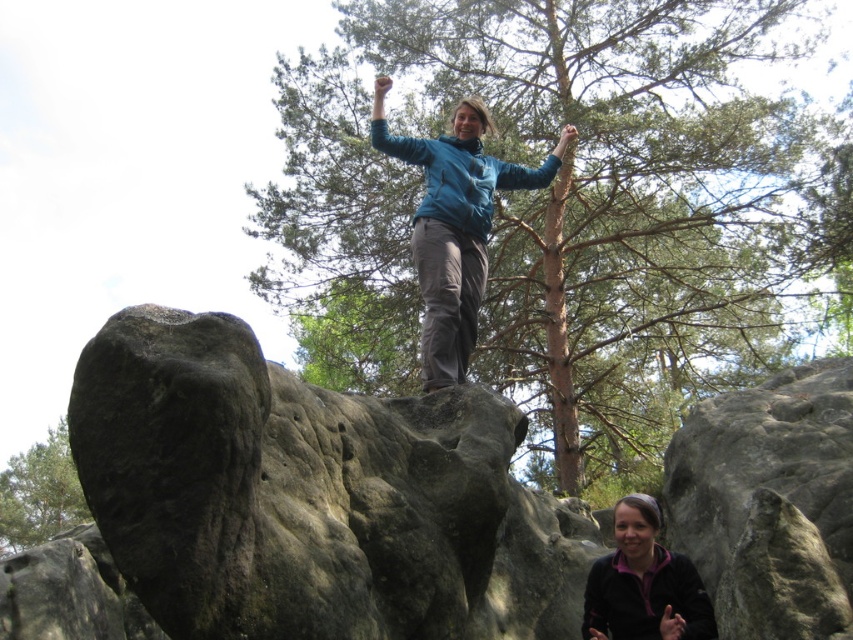
You are planning to take a photo of the two trees in the scene. The photographer wants to ensure that the brown textured tree at upper center and the green leafy tree at upper left are both visible in the frame. Considering their sizes, which tree should be placed closer to the edges of the frame to avoid overcrowding the composition?

The brown textured tree at upper center is wider than the green leafy tree at upper left, so placing the wider brown textured tree at upper center closer to the edges of the frame would help prevent overcrowding the composition.

You are a hiker who wants to place a 3 feet long hiking pole between the dark gray rough rock at center and the matte black jacket at lower center. Can you fit the pole between them without bending it?

The distance between the dark gray rough rock at center and the matte black jacket at lower center is 9.17 feet. Since the pole is 3 feet long, it can easily fit between them without bending.

You are a photographer trying to capture a clear photo of the teal fabric jacket at center and the brown textured tree at upper center. However, the tree is blocking part of the jacket. Based on the scene description, can you adjust your position to see the entire jacket without the tree obstructing it?

The teal fabric jacket at center is behind the brown textured tree at upper center, so moving your position to the left or right might allow you to see the jacket without obstruction from the tree.